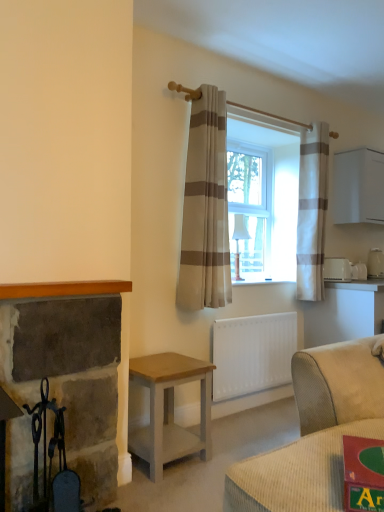
Locate an element on the screen. Image resolution: width=384 pixels, height=512 pixels. empty space that is ontop of light brown wood table at lower center (from a real-world perspective) is located at coordinates (157, 361).